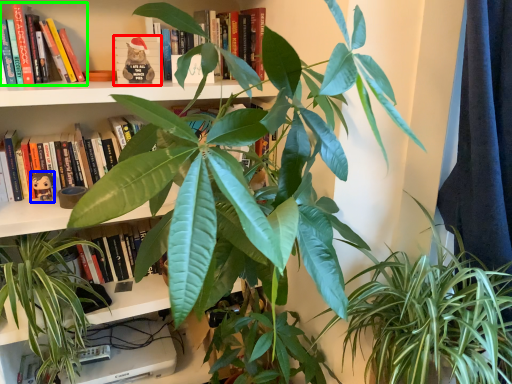
Question: Which is nearer to the paperback book (highlighted by a red box)? toy (highlighted by a blue box) or book (highlighted by a green box).

Choices:
 (A) toy
 (B) book

Answer: (B)